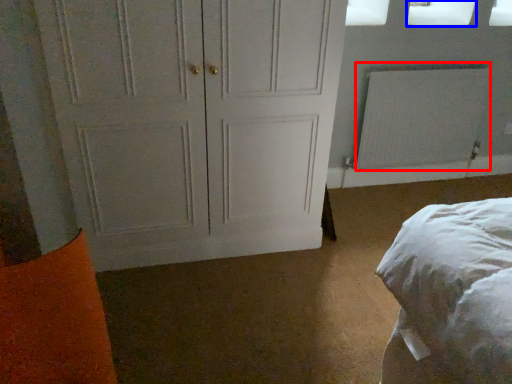
Question: Which object is further to the camera taking this photo, radiator (highlighted by a red box) or window screen (highlighted by a blue box)?

Choices:
 (A) radiator
 (B) window screen

Answer: (A)